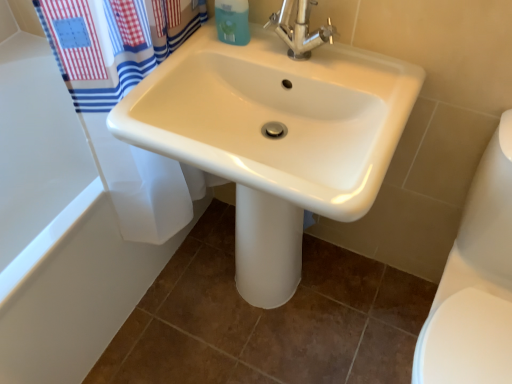
Question: From the image's perspective, is blue matte soap dispenser at upper center beneath white glossy sink at center?

Choices:
 (A) yes
 (B) no

Answer: (B)

Question: Does blue matte soap dispenser at upper center have a smaller size compared to white glossy sink at center?

Choices:
 (A) yes
 (B) no

Answer: (A)

Question: Is blue matte soap dispenser at upper center bigger than white glossy sink at center?

Choices:
 (A) yes
 (B) no

Answer: (B)

Question: Does blue matte soap dispenser at upper center have a greater width compared to white glossy sink at center?

Choices:
 (A) no
 (B) yes

Answer: (A)

Question: Can you confirm if blue matte soap dispenser at upper center is positioned to the left of white glossy sink at center?

Choices:
 (A) yes
 (B) no

Answer: (A)

Question: Considering the relative positions of blue matte soap dispenser at upper center and white glossy sink at center in the image provided, is blue matte soap dispenser at upper center to the right of white glossy sink at center from the viewer's perspective?

Choices:
 (A) no
 (B) yes

Answer: (A)

Question: From the image's perspective, is white glossy bathtub at upper left above blue matte soap dispenser at upper center?

Choices:
 (A) yes
 (B) no

Answer: (B)

Question: Is white glossy bathtub at upper left shorter than blue matte soap dispenser at upper center?

Choices:
 (A) yes
 (B) no

Answer: (B)

Question: From a real-world perspective, is white glossy bathtub at upper left positioned under blue matte soap dispenser at upper center based on gravity?

Choices:
 (A) yes
 (B) no

Answer: (A)

Question: From a real-world perspective, does white glossy bathtub at upper left stand above blue matte soap dispenser at upper center?

Choices:
 (A) yes
 (B) no

Answer: (B)

Question: Is white glossy bathtub at upper left oriented towards blue matte soap dispenser at upper center?

Choices:
 (A) no
 (B) yes

Answer: (A)

Question: Considering the relative positions of white glossy bathtub at upper left and blue matte soap dispenser at upper center in the image provided, is white glossy bathtub at upper left to the right of blue matte soap dispenser at upper center from the viewer's perspective?

Choices:
 (A) yes
 (B) no

Answer: (B)

Question: Can chrome metallic faucet at upper center be found inside white glossy toilet bowl at lower right?

Choices:
 (A) yes
 (B) no

Answer: (B)